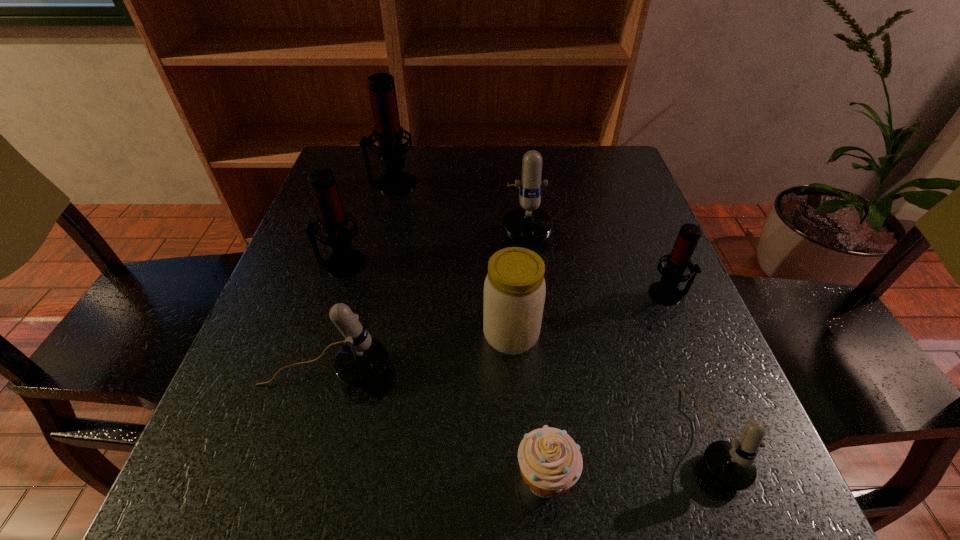
At what (x,y) coordinates should I click in order to perform the action: click on free space at the near right corner of the desktop. Please return your answer as a coordinate pair (x, y). Looking at the image, I should click on (665, 504).

Identify the location of free space between the smallest white microphone and the farthest white microphone. (617, 327).

Locate an element on the screen. free spot between the jar and the smallest white microphone is located at coordinates (612, 387).

Identify the location of free space between the muffin and the jar. The width and height of the screenshot is (960, 540). (528, 407).

The image size is (960, 540). In order to click on free point between the fourth microphone from left to right and the leftmost white microphone in this screenshot , I will do `click(425, 293)`.

Identify the location of free spot between the fourth microphone from left to right and the muffin. This screenshot has width=960, height=540. (535, 347).

Where is `empty location between the smallest white microphone and the farthest white microphone`? The width and height of the screenshot is (960, 540). empty location between the smallest white microphone and the farthest white microphone is located at coordinates (617, 327).

This screenshot has height=540, width=960. Identify the location of the sixth closest object to the muffin. (344, 261).

Locate which object is the sixth closest to the rightmost white microphone. Please provide its 2D coordinates. Your answer should be formatted as a tuple, i.e. [(x, y)], where the tuple contains the x and y coordinates of a point satisfying the conditions above.

[(344, 261)]

This screenshot has width=960, height=540. In order to click on microphone that is the second closest to the second farthest red microphone in this screenshot , I will do `click(388, 132)`.